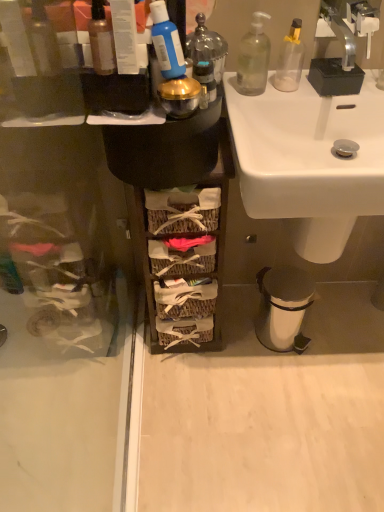
Where is `vacant position to the left of transparent plastic screen door at left`? vacant position to the left of transparent plastic screen door at left is located at coordinates 55,402.